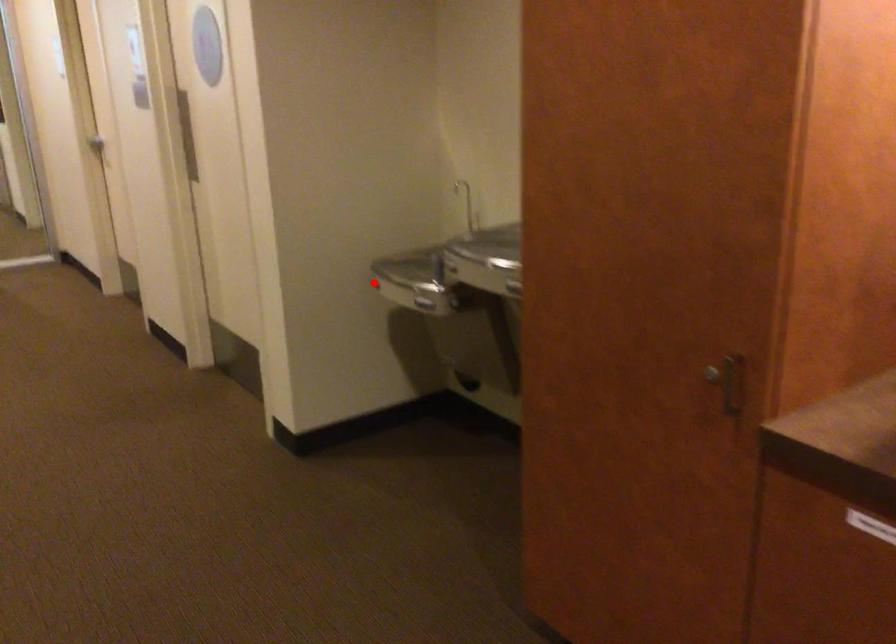
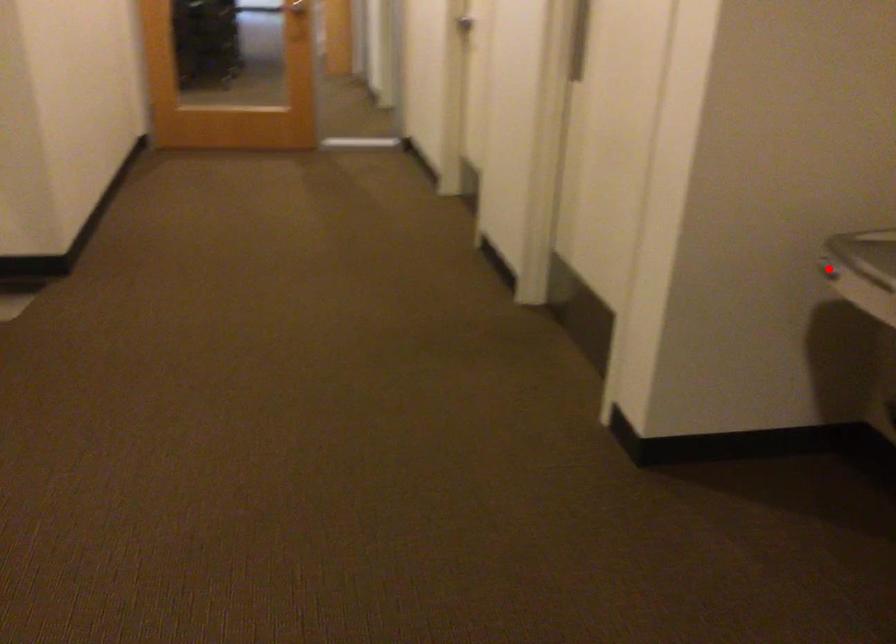
I am providing you with two images of the same scene from different viewpoints. A red point is marked on the first image and another point is marked on the second image. Is the red point in image1 aligned with the point shown in image2?

Yes